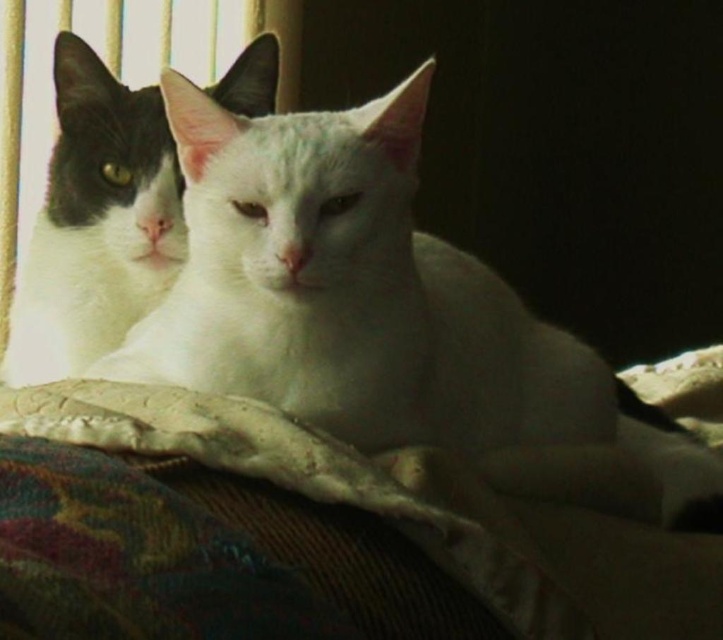
Does white soft fur cat at center appear under black and white fur cat at left?

Indeed, white soft fur cat at center is positioned under black and white fur cat at left.

Is point (150, 316) closer to viewer compared to point (100, 100)?

Yes, point (150, 316) is closer to viewer.

The width and height of the screenshot is (723, 640). Find the location of `white soft fur cat at center`. white soft fur cat at center is located at coordinates (372, 301).